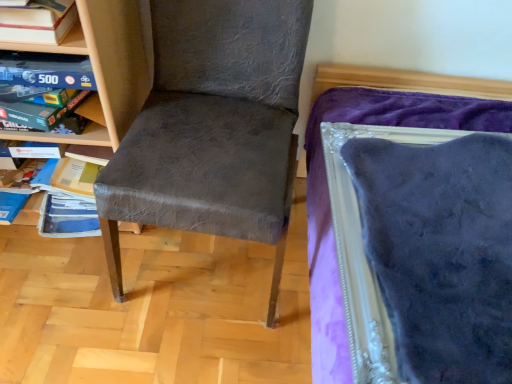
Question: Is wooden bookshelf at left, which is counted as the 2th shelf, starting from the back, far away from matte gray chair at center?

Choices:
 (A) yes
 (B) no

Answer: (B)

Question: From a real-world perspective, is wooden bookshelf at left, which is counted as the first shelf, starting from the front, beneath matte gray chair at center?

Choices:
 (A) yes
 (B) no

Answer: (A)

Question: Can you confirm if wooden bookshelf at left, which is counted as the 2th shelf, starting from the back, is thinner than matte gray chair at center?

Choices:
 (A) no
 (B) yes

Answer: (B)

Question: From a real-world perspective, does wooden bookshelf at left, which is counted as the first shelf, starting from the front, stand above matte gray chair at center?

Choices:
 (A) no
 (B) yes

Answer: (A)

Question: Is wooden bookshelf at left, which is counted as the first shelf, starting from the front, next to matte gray chair at center?

Choices:
 (A) no
 (B) yes

Answer: (A)

Question: From the image's perspective, is matte gray chair at center located above or below wooden bookshelf at left, which is counted as the 2th shelf, starting from the back?

Choices:
 (A) below
 (B) above

Answer: (A)

Question: Considering the positions of matte gray chair at center and wooden bookshelf at left, which is counted as the 2th shelf, starting from the back, in the image, is matte gray chair at center bigger or smaller than wooden bookshelf at left, which is counted as the 2th shelf, starting from the back,?

Choices:
 (A) small
 (B) big

Answer: (B)

Question: Considering the positions of matte gray chair at center and wooden bookshelf at left, which is counted as the first shelf, starting from the front, in the image, is matte gray chair at center wider or thinner than wooden bookshelf at left, which is counted as the first shelf, starting from the front,?

Choices:
 (A) thin
 (B) wide

Answer: (B)

Question: Would you say matte gray chair at center is inside or outside wooden bookshelf at left, which is counted as the 2th shelf, starting from the back?

Choices:
 (A) inside
 (B) outside

Answer: (B)

Question: Considering the positions of wooden bookshelf at left, which is counted as the 2th shelf, starting from the back, and matte gray chair at center in the image, is wooden bookshelf at left, which is counted as the 2th shelf, starting from the back, bigger or smaller than matte gray chair at center?

Choices:
 (A) big
 (B) small

Answer: (B)

Question: Considering the positions of wooden bookshelf at left, which is counted as the 2th shelf, starting from the back, and matte gray chair at center in the image, is wooden bookshelf at left, which is counted as the 2th shelf, starting from the back, wider or thinner than matte gray chair at center?

Choices:
 (A) thin
 (B) wide

Answer: (A)

Question: From the image's perspective, is wooden bookshelf at left, which is counted as the 2th shelf, starting from the back, located above or below matte gray chair at center?

Choices:
 (A) below
 (B) above

Answer: (B)

Question: Is point (117, 140) closer or farther from the camera than point (162, 41)?

Choices:
 (A) farther
 (B) closer

Answer: (B)

Question: From a real-world perspective, relative to matte gray chair at center, is wooden board game at upper left, which ranks as the 1th shelf in back-to-front order, vertically above or below?

Choices:
 (A) above
 (B) below

Answer: (A)

Question: Does point tap(109, 140) appear closer or farther from the camera than point tap(150, 94)?

Choices:
 (A) farther
 (B) closer

Answer: (A)